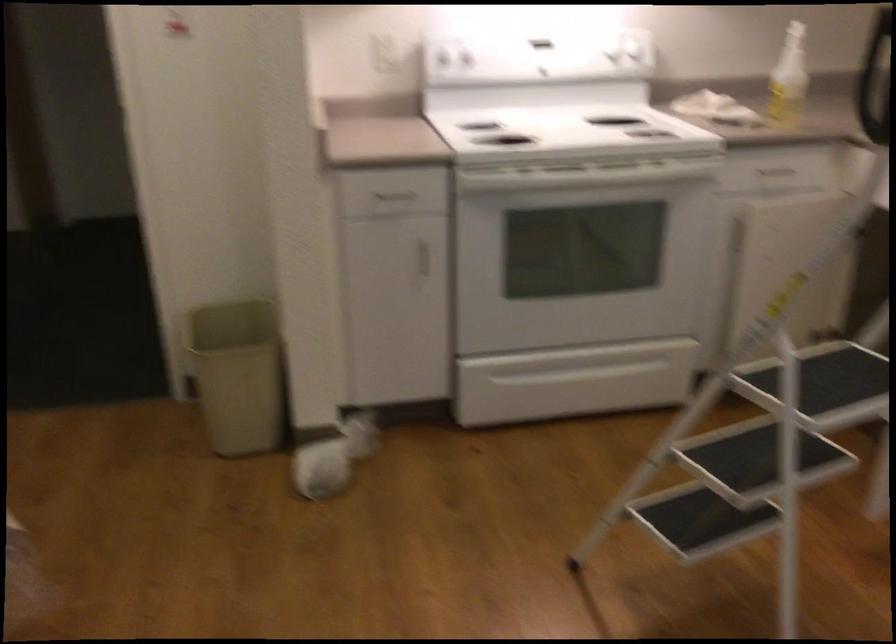
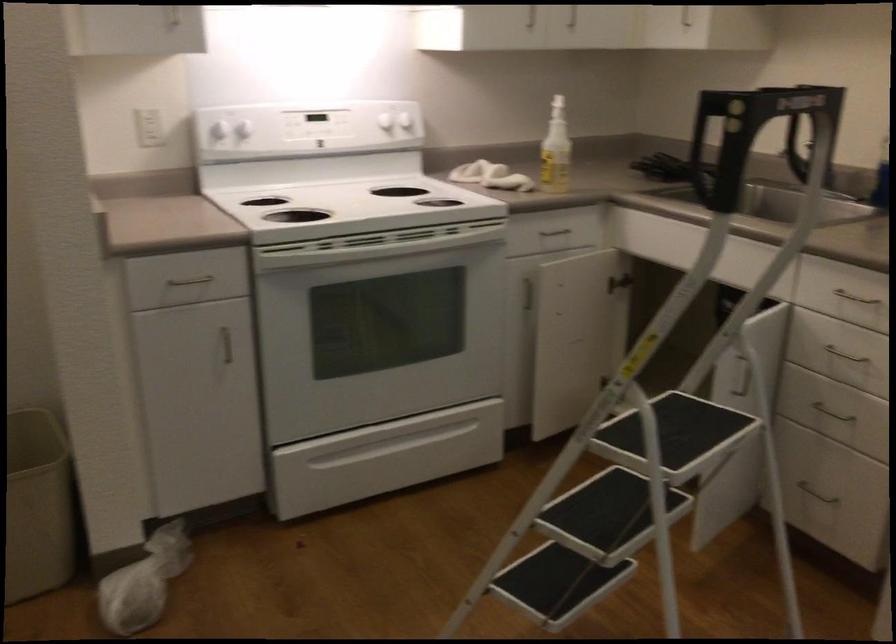
Question: The camera is either moving clockwise (left) or counter-clockwise (right) around the object. The first image is from the beginning of the video and the second image is from the end. Is the camera moving left or right when shooting the video?

Choices:
 (A) Left
 (B) Right

Answer: (A)